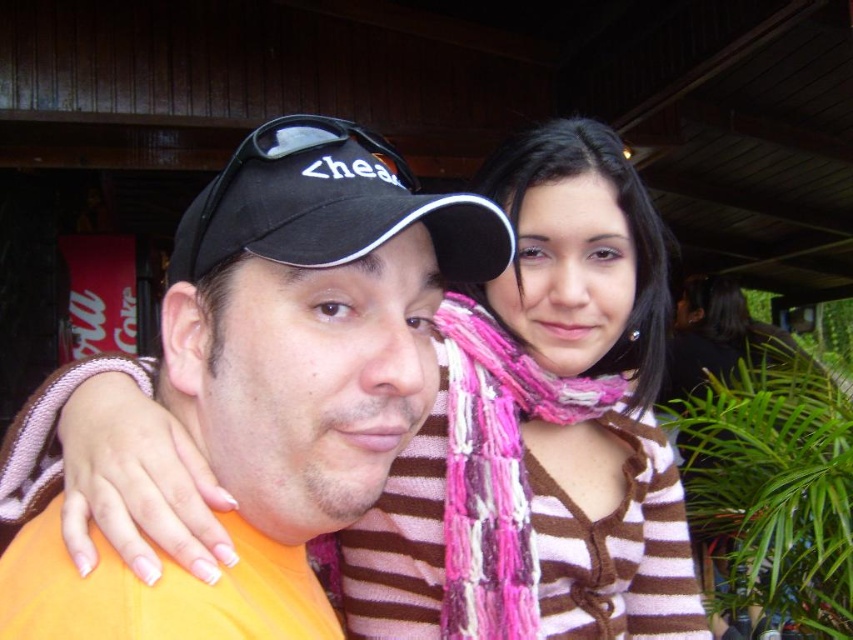
How much distance is there between orange fabric shirt at center and black fabric baseball cap at center?

They are 1.64 inches apart.

Is orange fabric shirt at center taller than black fabric baseball cap at center?

Yes, orange fabric shirt at center is taller than black fabric baseball cap at center.

What do you see at coordinates (314, 312) in the screenshot? The height and width of the screenshot is (640, 853). I see `orange fabric shirt at center` at bounding box center [314, 312].

Where is `orange fabric shirt at center`? Image resolution: width=853 pixels, height=640 pixels. orange fabric shirt at center is located at coordinates (314, 312).

Can you confirm if orange fabric shirt at center is bigger than pink yarn scarf at center?

Actually, orange fabric shirt at center might be smaller than pink yarn scarf at center.

Is point (322, 385) in front of point (495, 488)?

Yes, point (322, 385) is closer to viewer.

Image resolution: width=853 pixels, height=640 pixels. What do you see at coordinates (314, 312) in the screenshot? I see `orange fabric shirt at center` at bounding box center [314, 312].

Find the location of `orange fabric shirt at center`. orange fabric shirt at center is located at coordinates (314, 312).

This screenshot has height=640, width=853. I want to click on black fabric baseball cap at center, so click(329, 205).

Who is more distant from viewer, (247, 172) or (453, 580)?

Positioned behind is point (453, 580).

The height and width of the screenshot is (640, 853). In order to click on black fabric baseball cap at center in this screenshot , I will do `click(329, 205)`.